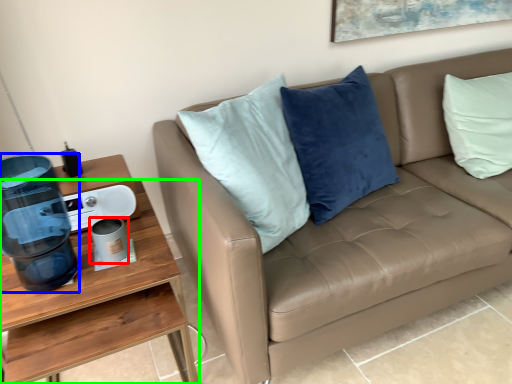
Question: Which is farther away from coffee cup (highlighted by a red box)? water cooler (highlighted by a blue box) or desk (highlighted by a green box)?

Choices:
 (A) water cooler
 (B) desk

Answer: (A)